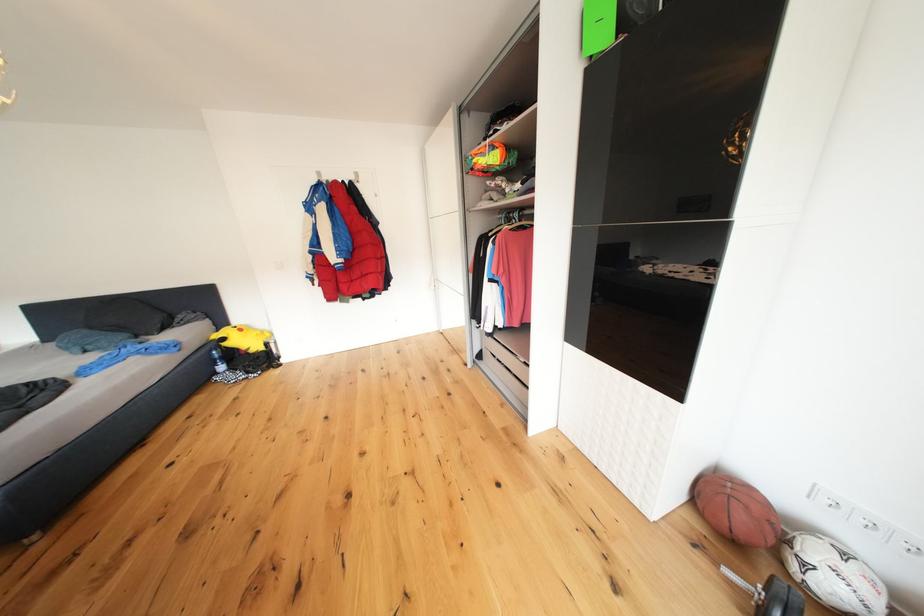
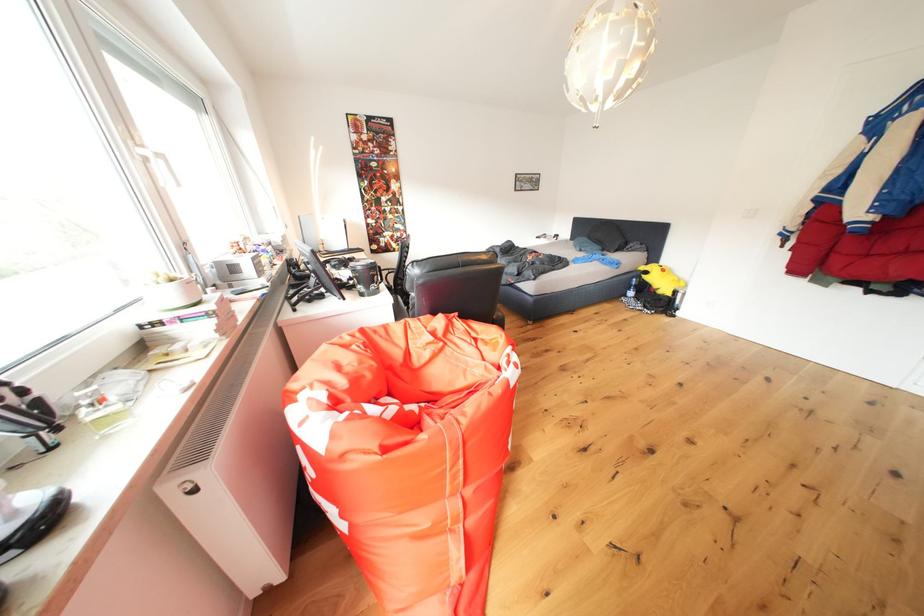
The point at (234, 349) is marked in the first image. Where is the corresponding point in the second image?

(653, 282)